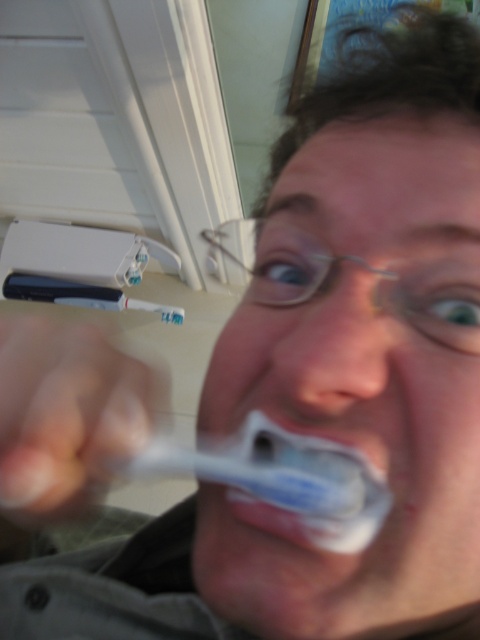
Question: Which point is farther to the camera?

Choices:
 (A) (x=274, y=474)
 (B) (x=322, y=492)

Answer: (A)

Question: Observing the image, what is the correct spatial positioning of white soft toothbrush at center in reference to white plastic toothbrush at center?

Choices:
 (A) left
 (B) right

Answer: (B)

Question: Is white soft toothbrush at center to the right of white plastic toothbrush at center from the viewer's perspective?

Choices:
 (A) yes
 (B) no

Answer: (A)

Question: Does white soft toothbrush at center come in front of white plastic toothbrush at center?

Choices:
 (A) no
 (B) yes

Answer: (A)

Question: Which of the following is the farthest from the observer?

Choices:
 (A) white soft toothbrush at center
 (B) white plastic toothbrush at center

Answer: (A)